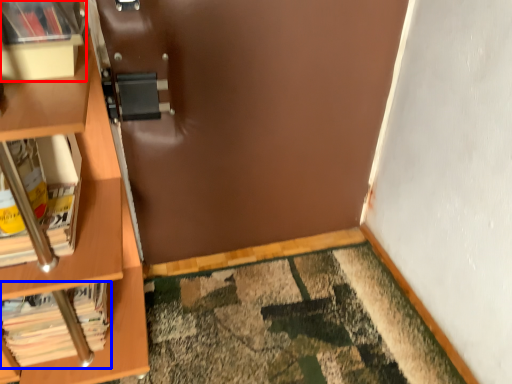
Question: Which object is further to the camera taking this photo, shelf (highlighted by a red box) or book (highlighted by a blue box)?

Choices:
 (A) shelf
 (B) book

Answer: (B)